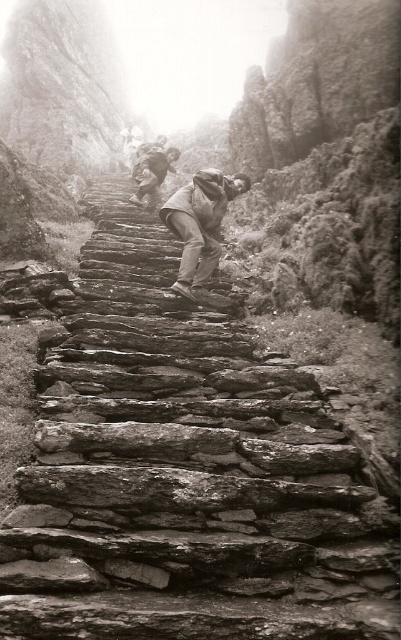
Question: Which object is closer to the camera taking this photo?

Choices:
 (A) rugged brown jacket at center
 (B) rugged stone steps at center

Answer: (A)

Question: Does rugged brown jacket at center appear on the right side of rugged stone steps at center?

Choices:
 (A) no
 (B) yes

Answer: (B)

Question: Is rugged brown jacket at center below rugged stone steps at center?

Choices:
 (A) no
 (B) yes

Answer: (B)

Question: Considering the relative positions of rugged brown jacket at center and rugged stone steps at center in the image provided, where is rugged brown jacket at center located with respect to rugged stone steps at center?

Choices:
 (A) left
 (B) right

Answer: (B)